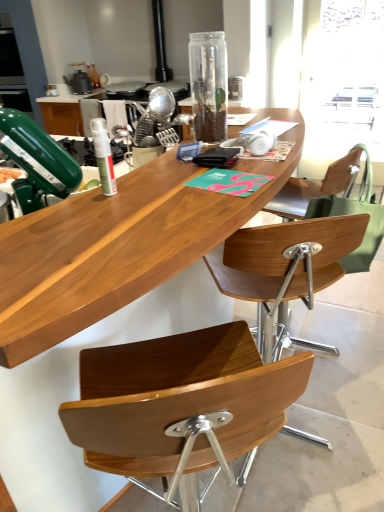
Question: Is wooden desk at center placed right next to metallic silver whisk at center, arranged as the second appliance when viewed from the left?

Choices:
 (A) yes
 (B) no

Answer: (B)

Question: Is wooden desk at center thinner than metallic silver whisk at center, arranged as the second appliance when viewed from the left?

Choices:
 (A) yes
 (B) no

Answer: (B)

Question: Can we say wooden desk at center lies outside metallic silver whisk at center, which is the first appliance from front to back?

Choices:
 (A) no
 (B) yes

Answer: (B)

Question: Can you confirm if wooden desk at center is positioned to the left of metallic silver whisk at center, which is counted as the first appliance, starting from the right?

Choices:
 (A) no
 (B) yes

Answer: (B)

Question: Is wooden desk at center positioned before metallic silver whisk at center, acting as the second appliance starting from the back?

Choices:
 (A) yes
 (B) no

Answer: (A)

Question: From the image's perspective, is wooden desk at center below metallic silver whisk at center, which is the first appliance from front to back?

Choices:
 (A) yes
 (B) no

Answer: (A)

Question: Does transparent glass bottle at center, which is the second bottle in front-to-back order, come behind wooden desk at center?

Choices:
 (A) yes
 (B) no

Answer: (A)

Question: Can you confirm if transparent glass bottle at center, the second bottle viewed from the left, is positioned to the left of wooden desk at center?

Choices:
 (A) yes
 (B) no

Answer: (B)

Question: Considering the relative sizes of transparent glass bottle at center, placed as the first bottle when sorted from back to front, and wooden desk at center in the image provided, is transparent glass bottle at center, placed as the first bottle when sorted from back to front, wider than wooden desk at center?

Choices:
 (A) no
 (B) yes

Answer: (A)

Question: From a real-world perspective, does transparent glass bottle at center, the first bottle from the right, sit lower than wooden desk at center?

Choices:
 (A) no
 (B) yes

Answer: (A)

Question: Is there a large distance between transparent glass bottle at center, placed as the first bottle when sorted from back to front, and wooden desk at center?

Choices:
 (A) yes
 (B) no

Answer: (A)

Question: Considering the relative sizes of transparent glass bottle at center, which is the second bottle in front-to-back order, and wooden desk at center in the image provided, is transparent glass bottle at center, which is the second bottle in front-to-back order, thinner than wooden desk at center?

Choices:
 (A) no
 (B) yes

Answer: (B)

Question: Is transparent plastic window screen at upper right positioned beyond the bounds of transparent glass bottle at center, the second bottle viewed from the left?

Choices:
 (A) no
 (B) yes

Answer: (B)